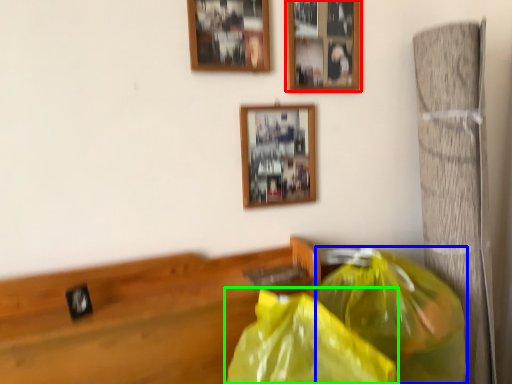
Question: Estimate the real-world distances between objects in this image. Which object is farther from picture frame (highlighted by a red box), plastic bag (highlighted by a blue box) or plastic bag (highlighted by a green box)?

Choices:
 (A) plastic bag
 (B) plastic bag

Answer: (B)